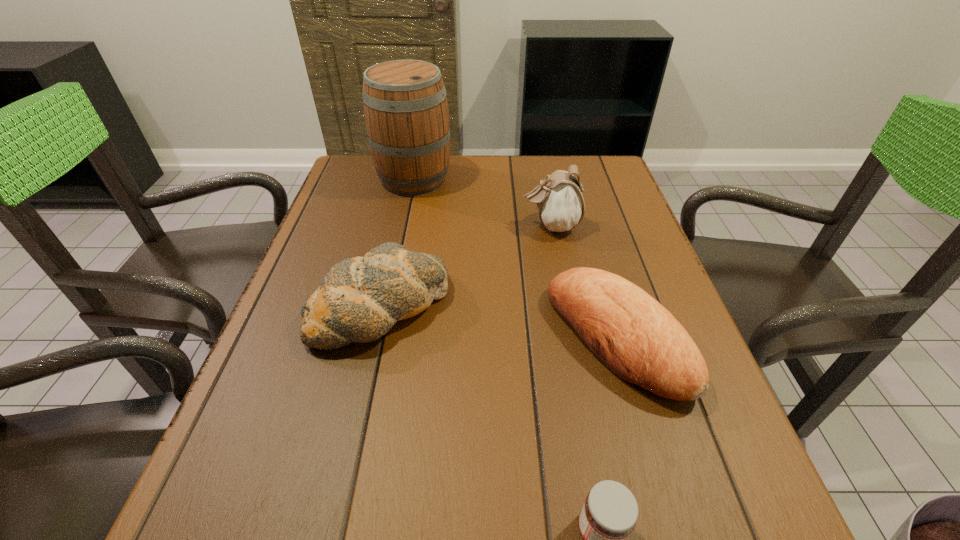
The image size is (960, 540). I want to click on free point located on the front-facing side of the second tallest object, so click(x=391, y=226).

Find the location of a particular element. This screenshot has width=960, height=540. free space located 0.100m on the right of the left bread is located at coordinates (493, 307).

I want to click on vacant area situated on the left of the right bread, so click(x=410, y=338).

Locate an element on the screen. object positioned at the far edge is located at coordinates (406, 112).

Locate an element on the screen. The width and height of the screenshot is (960, 540). cider that is at the left edge is located at coordinates (406, 112).

Identify the location of bread situated at the left edge. The width and height of the screenshot is (960, 540). (360, 299).

This screenshot has width=960, height=540. Identify the location of pouch that is at the right edge. (559, 199).

Find the location of a particular element. Image resolution: width=960 pixels, height=540 pixels. bread that is at the right edge is located at coordinates (635, 337).

What are the coordinates of `object that is at the far left corner` in the screenshot? It's located at (406, 112).

Image resolution: width=960 pixels, height=540 pixels. What are the coordinates of `vacant space at the far edge` in the screenshot? It's located at (467, 171).